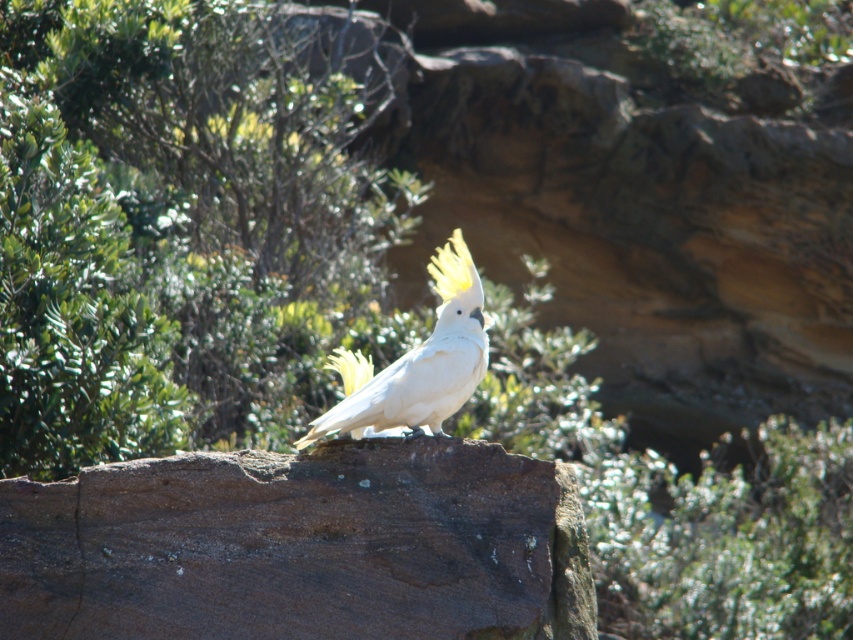
Which is below, brown rough rock at center or white feathered cockatoo at center?

Positioned lower is brown rough rock at center.

Can you confirm if brown rough rock at center is positioned above white feathered cockatoo at center?

Actually, brown rough rock at center is below white feathered cockatoo at center.

Who is more distant from viewer, (80, 496) or (457, 228)?

The point (457, 228) is more distant.

I want to click on brown rough rock at center, so click(x=300, y=547).

Does green leafy shrub at center have a lesser height compared to white feathered cockatoo at center?

Incorrect, green leafy shrub at center's height does not fall short of white feathered cockatoo at center's.

Which is more to the right, green leafy shrub at center or white feathered cockatoo at center?

white feathered cockatoo at center

Is point (175, 291) positioned before point (456, 321)?

No, (175, 291) is behind (456, 321).

Where is `green leafy shrub at center`? Image resolution: width=853 pixels, height=640 pixels. green leafy shrub at center is located at coordinates (171, 228).

Does green leafy shrub at center have a lesser height compared to brown rough rock at center?

Incorrect, green leafy shrub at center's height does not fall short of brown rough rock at center's.

Between green leafy shrub at center and brown rough rock at center, which one is positioned lower?

brown rough rock at center is lower down.

Does point (42, 323) come closer to viewer compared to point (390, 515)?

No, (42, 323) is behind (390, 515).

Find the location of a particular element. The image size is (853, 640). green leafy shrub at center is located at coordinates (171, 228).